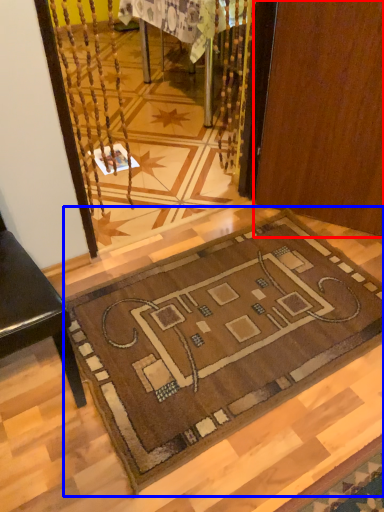
Question: Which object appears closest to the camera in this image, door (highlighted by a red box) or mat (highlighted by a blue box)?

Choices:
 (A) door
 (B) mat

Answer: (B)